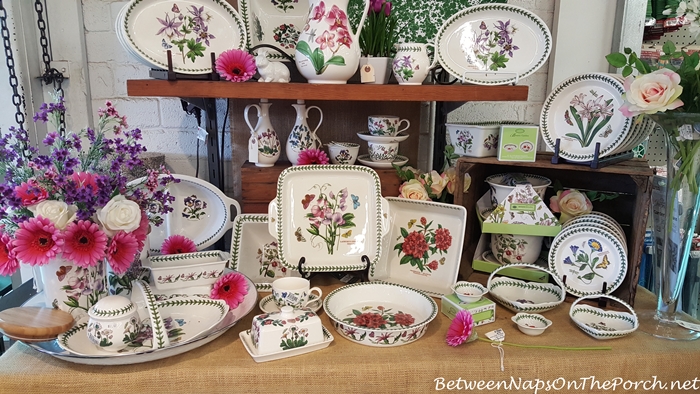
The height and width of the screenshot is (394, 700). Find the location of `water in vase`. water in vase is located at coordinates (666, 285).